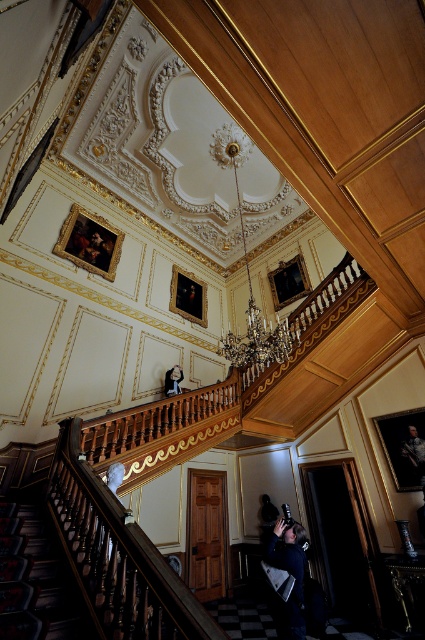
From the picture: Can you confirm if dark wood stairwell at lower left is positioned to the left of smooth white statue at center?

Yes, dark wood stairwell at lower left is to the left of smooth white statue at center.

Consider the image. Who is lower down, dark wood stairwell at lower left or smooth white statue at center?

dark wood stairwell at lower left is below.

Is point (17, 563) positioned behind point (178, 364)?

No.

I want to click on dark wood stairwell at lower left, so click(34, 580).